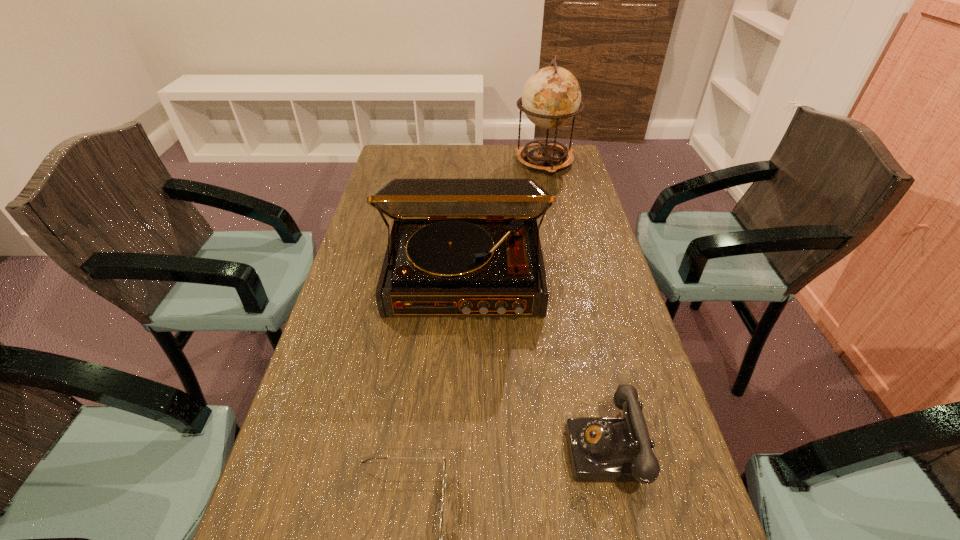
Identify the location of the tallest object. (551, 97).

Where is `globe`? globe is located at coordinates (551, 97).

Identify the location of the second tallest object. The image size is (960, 540). (458, 246).

Where is `the second farthest object`? the second farthest object is located at coordinates (458, 246).

Where is `telephone`? Image resolution: width=960 pixels, height=540 pixels. telephone is located at coordinates (601, 449).

Where is `vacant space situated 0.280m at the center of the globe`? This screenshot has height=540, width=960. vacant space situated 0.280m at the center of the globe is located at coordinates (559, 224).

Where is `free space located 0.330m on the front-facing side of the record player`? This screenshot has width=960, height=540. free space located 0.330m on the front-facing side of the record player is located at coordinates (458, 457).

Where is `vacant space located on the dial of the third tallest object`? Image resolution: width=960 pixels, height=540 pixels. vacant space located on the dial of the third tallest object is located at coordinates (483, 448).

Identify the location of vacant area situated on the dial of the third tallest object. This screenshot has height=540, width=960. (377, 448).

Locate an element on the screen. This screenshot has height=540, width=960. vacant region located 0.400m on the dial of the third tallest object is located at coordinates (356, 448).